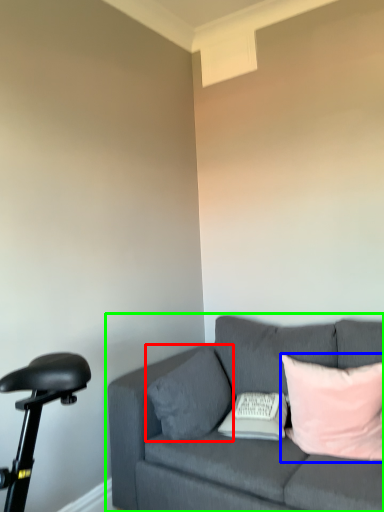
Question: Estimate the real-world distances between objects in this image. Which object is closer to pillow (highlighted by a red box), pillow (highlighted by a blue box) or studio couch (highlighted by a green box)?

Choices:
 (A) pillow
 (B) studio couch

Answer: (B)